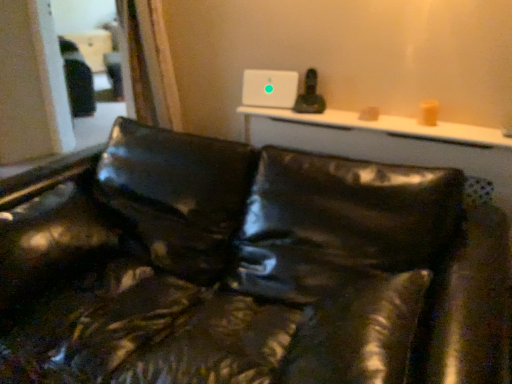
The height and width of the screenshot is (384, 512). What do you see at coordinates (247, 269) in the screenshot? I see `matte black couch at center` at bounding box center [247, 269].

The width and height of the screenshot is (512, 384). In order to click on matte black couch at center in this screenshot , I will do `click(247, 269)`.

What do you see at coordinates (384, 127) in the screenshot? Image resolution: width=512 pixels, height=384 pixels. I see `white glossy table at upper center` at bounding box center [384, 127].

This screenshot has height=384, width=512. What are the coordinates of `white glossy table at upper center` in the screenshot? It's located at (384, 127).

This screenshot has height=384, width=512. Find the location of `matte black couch at center`. matte black couch at center is located at coordinates (247, 269).

Does matte black couch at center appear on the right side of white glossy table at upper center?

No.

Which is in front, matte black couch at center or white glossy table at upper center?

matte black couch at center is more forward.

Which point is more forward, (x=137, y=129) or (x=340, y=112)?

The point (x=340, y=112) is more forward.

From the image's perspective, between matte black couch at center and white glossy table at upper center, which one is located above?

white glossy table at upper center, from the image's perspective.

From a real-world perspective, is matte black couch at center on white glossy table at upper center?

No, from a real-world perspective, matte black couch at center is not on top of white glossy table at upper center.

In terms of width, does matte black couch at center look wider or thinner when compared to white glossy table at upper center?

In the image, matte black couch at center appears to be wider than white glossy table at upper center.

Who is taller, matte black couch at center or white glossy table at upper center?

matte black couch at center.

Can you confirm if matte black couch at center is bigger than white glossy table at upper center?

Correct, matte black couch at center is larger in size than white glossy table at upper center.

Do you think matte black couch at center is within white glossy table at upper center, or outside of it?

matte black couch at center is outside white glossy table at upper center.

Would you consider matte black couch at center to be distant from white glossy table at upper center?

No, matte black couch at center is in close proximity to white glossy table at upper center.

Is matte black couch at center oriented away from white glossy table at upper center?

Absolutely, matte black couch at center is directed away from white glossy table at upper center.

How many degrees apart are the facing directions of matte black couch at center and white glossy table at upper center?

They differ by 0.00102 degrees in their facing directions.

Find the location of a particular element. This screenshot has height=384, width=512. studio couch that is under the white glossy table at upper center (from a real-world perspective) is located at coordinates (247, 269).

Consider the image. Which object is positioned more to the right, white glossy table at upper center or matte black couch at center?

white glossy table at upper center.

Is white glossy table at upper center positioned behind matte black couch at center?

Yes, the depth of white glossy table at upper center is greater than that of matte black couch at center.

Does point (420, 126) come farther from viewer compared to point (47, 335)?

Yes, it is.

From the image's perspective, which is above, white glossy table at upper center or matte black couch at center?

white glossy table at upper center.

From a real-world perspective, is white glossy table at upper center positioned under matte black couch at center based on gravity?

No.

Between white glossy table at upper center and matte black couch at center, which one has smaller width?

white glossy table at upper center is thinner.

Between white glossy table at upper center and matte black couch at center, which one has more height?

With more height is matte black couch at center.

Considering the sizes of white glossy table at upper center and matte black couch at center in the image, is white glossy table at upper center bigger or smaller than matte black couch at center?

In the image, white glossy table at upper center appears to be smaller than matte black couch at center.

Is white glossy table at upper center positioned beyond the bounds of matte black couch at center?

white glossy table at upper center lies outside matte black couch at center's area.

Are white glossy table at upper center and matte black couch at center located far from each other?

No, white glossy table at upper center is in close proximity to matte black couch at center.

Could you tell me if white glossy table at upper center is turned towards matte black couch at center?

No, white glossy table at upper center is not oriented towards matte black couch at center.

Consider the image. How different are the orientations of white glossy table at upper center and matte black couch at center in degrees?

The angle between the facing direction of white glossy table at upper center and the facing direction of matte black couch at center is 0.00102 degrees.

Where is `studio couch in front of the white glossy table at upper center`? This screenshot has width=512, height=384. studio couch in front of the white glossy table at upper center is located at coordinates (247, 269).

You are a GUI agent. You are given a task and a screenshot of the screen. Output one action in this format:
    pyautogui.click(x=<x>, y=<y>)
    Task: Click on the table located above the matte black couch at center (from the image's perspective)
    
    Given the screenshot: What is the action you would take?
    pyautogui.click(x=384, y=127)

You are a GUI agent. You are given a task and a screenshot of the screen. Output one action in this format:
    pyautogui.click(x=<x>, y=<y>)
    Task: Click on the table above the matte black couch at center (from a real-world perspective)
    This screenshot has width=512, height=384.
    Given the screenshot: What is the action you would take?
    pyautogui.click(x=384, y=127)